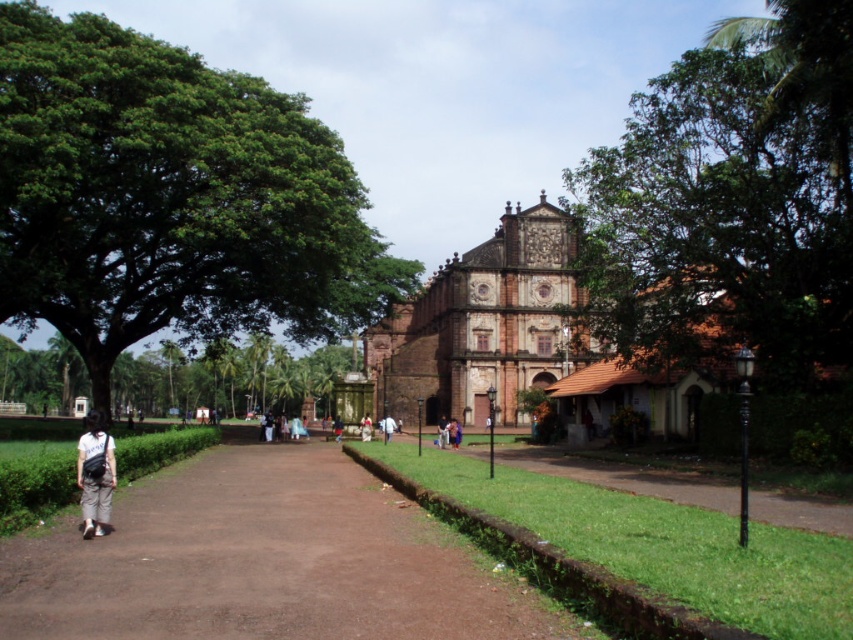
Is green leafy tree at lower left wider than white fabric at center?

Correct, the width of green leafy tree at lower left exceeds that of white fabric at center.

Is point (32, 358) behind point (386, 422)?

Yes, it is behind point (386, 422).

Does point (45, 362) lie behind point (387, 435)?

Yes, it is.

Identify the location of green leafy tree at lower left. (175, 378).

Is brown dirt path at center above light beige fabric bag at lower left?

No.

Between brown dirt path at center and light beige fabric bag at lower left, which one has less height?

With less height is light beige fabric bag at lower left.

Which is in front, point (142, 625) or point (88, 486)?

Point (142, 625) is in front.

Image resolution: width=853 pixels, height=640 pixels. In order to click on brown dirt path at center in this screenshot , I will do `click(264, 561)`.

Based on the photo, is green leafy tree at center taller than green leafy tree at lower left?

Indeed, green leafy tree at center has a greater height compared to green leafy tree at lower left.

The width and height of the screenshot is (853, 640). What do you see at coordinates (730, 202) in the screenshot?
I see `green leafy tree at center` at bounding box center [730, 202].

This screenshot has height=640, width=853. I want to click on green leafy tree at center, so click(x=730, y=202).